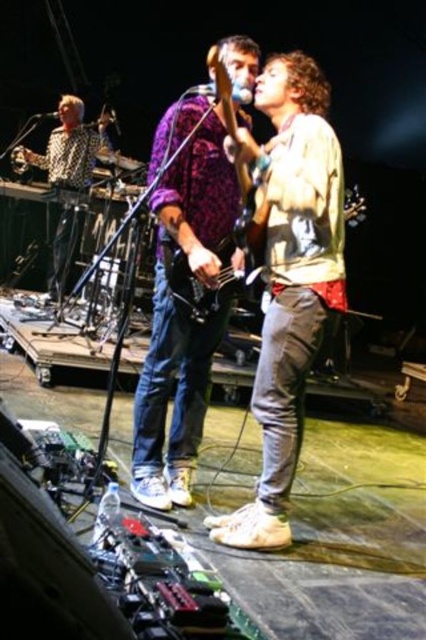
You are a photographer trying to capture the best shot of the stage. You notice two points on the stage marked as point (339,221) and point (81,128). Which point should you focus on to ensure it appears larger in your photo?

Point (339,221) is closer to the camera than point (81,128), so focusing on point (339,221) will make it appear larger in the photo.

You are a photographer standing at the back of the venue. You want to take a photo of both the white leather jacket at center and the purple textured shirt at center in the same frame. The camera you are using has a minimum focus distance of 1 meter. Can you capture both subjects clearly in the photo?

The distance between the white leather jacket at center and the purple textured shirt at center is 12.56 inches, which is approximately 0.32 meters. Since the camera requires a minimum focus distance of 1 meter, the subjects are too close to each other to be captured clearly in the same frame.

You are a photographer in the front row of the concert. You want to capture a closeup of the shiny purple guitar at center and the metallic silver microphone at upper center in the same shot. Which object will appear larger in your photo?

The shiny purple guitar at center will appear larger in the photo because it is closer to the viewer than the metallic silver microphone at upper center.